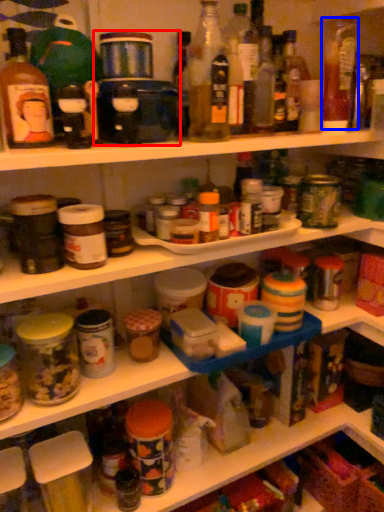
Question: Which point is further to the camera, appliance (highlighted by a red box) or bottle (highlighted by a blue box)?

Choices:
 (A) appliance
 (B) bottle

Answer: (B)